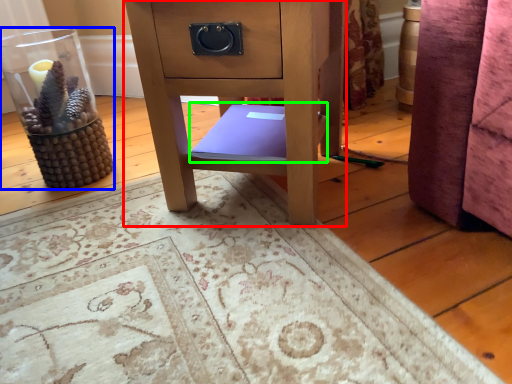
Question: Which object is positioned farthest from furniture (highlighted by a red box)? Select from glass vase (highlighted by a blue box) and book (highlighted by a green box).

Choices:
 (A) glass vase
 (B) book

Answer: (A)